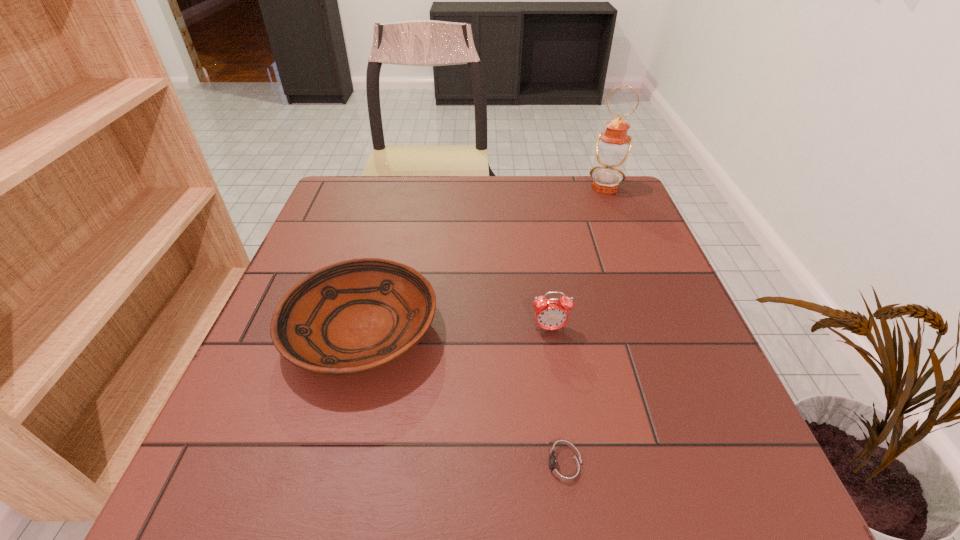
I want to click on vacant space located 0.160m on the face of the shortest object, so click(x=424, y=467).

Find the location of a particular element. The image size is (960, 540). vacant region located 0.070m on the face of the shortest object is located at coordinates (483, 467).

Image resolution: width=960 pixels, height=540 pixels. Identify the location of free space located on the face of the shortest object. (411, 467).

At what (x,y) coordinates should I click in order to perform the action: click on object that is at the far edge. Please return your answer as a coordinate pair (x, y). Image resolution: width=960 pixels, height=540 pixels. Looking at the image, I should click on (612, 147).

Where is `object present at the near edge`? object present at the near edge is located at coordinates (564, 468).

Find the location of a particular element. Image resolution: width=960 pixels, height=540 pixels. object that is at the left edge is located at coordinates (354, 316).

I want to click on object that is at the right edge, so click(612, 147).

Where is `object positioned at the far right corner`? object positioned at the far right corner is located at coordinates (612, 147).

In the image, there is a desktop. Where is `vacant space at the far edge`? Image resolution: width=960 pixels, height=540 pixels. vacant space at the far edge is located at coordinates (530, 215).

The height and width of the screenshot is (540, 960). Find the location of `vacant area at the near edge`. vacant area at the near edge is located at coordinates (393, 469).